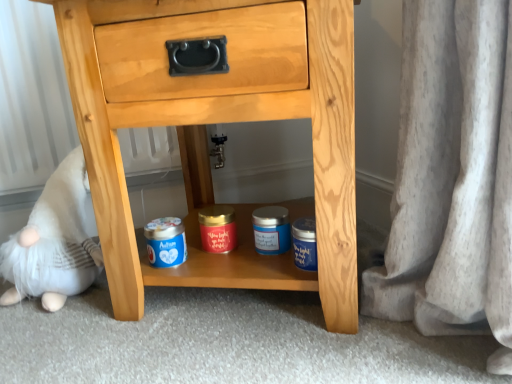
Identify the location of white plush toy at lower left. This screenshot has width=512, height=384. (53, 242).

Describe the element at coordinates (53, 242) in the screenshot. I see `white plush toy at lower left` at that location.

This screenshot has width=512, height=384. What do you see at coordinates (206, 141) in the screenshot?
I see `natural wood chest of drawers at center` at bounding box center [206, 141].

This screenshot has height=384, width=512. Identify the location of natural wood chest of drawers at center. (206, 141).

In order to face natural wood chest of drawers at center, should I rotate leftwards or rightwards?

You should rotate left by 1.615 degrees.

Measure the distance between natural wood chest of drawers at center and camera.

natural wood chest of drawers at center and camera are 22.48 inches apart from each other.

Find the location of `white plush toy at lower left`. white plush toy at lower left is located at coordinates [x=53, y=242].

Visually, is natural wood chest of drawers at center positioned to the left or to the right of white plush toy at lower left?

natural wood chest of drawers at center is to the right of white plush toy at lower left.

Is the position of natural wood chest of drawers at center more distant than that of white plush toy at lower left?

No, natural wood chest of drawers at center is closer to the camera.

Which is nearer, (143, 271) or (77, 181)?

Point (143, 271).

From the image's perspective, is natural wood chest of drawers at center over white plush toy at lower left?

Indeed, from the image's perspective, natural wood chest of drawers at center is shown above white plush toy at lower left.

From the picture: From a real-world perspective, is natural wood chest of drawers at center under white plush toy at lower left?

Actually, natural wood chest of drawers at center is physically above white plush toy at lower left in the real world.

Can you confirm if natural wood chest of drawers at center is wider than white plush toy at lower left?

Indeed, natural wood chest of drawers at center has a greater width compared to white plush toy at lower left.

Considering the relative sizes of natural wood chest of drawers at center and white plush toy at lower left in the image provided, is natural wood chest of drawers at center shorter than white plush toy at lower left?

No, natural wood chest of drawers at center is not shorter than white plush toy at lower left.

Can you confirm if natural wood chest of drawers at center is bigger than white plush toy at lower left?

Correct, natural wood chest of drawers at center is larger in size than white plush toy at lower left.

Could white plush toy at lower left be considered to be inside natural wood chest of drawers at center?

No, natural wood chest of drawers at center does not contain white plush toy at lower left.

Are natural wood chest of drawers at center and white plush toy at lower left beside each other?

No.

Is natural wood chest of drawers at center positioned with its back to white plush toy at lower left?

natural wood chest of drawers at center does not have its back to white plush toy at lower left.

At what (x,y) coordinates should I click in order to perform the action: click on toy directly beneath the natural wood chest of drawers at center (from a real-world perspective). Please return your answer as a coordinate pair (x, y). The image size is (512, 384). Looking at the image, I should click on (53, 242).

Considering the relative positions of white plush toy at lower left and natural wood chest of drawers at center in the image provided, is white plush toy at lower left to the left of natural wood chest of drawers at center from the viewer's perspective?

Indeed, white plush toy at lower left is positioned on the left side of natural wood chest of drawers at center.

Is white plush toy at lower left closer to camera compared to natural wood chest of drawers at center?

No, white plush toy at lower left is behind natural wood chest of drawers at center.

Which is farther from the camera, (x=82, y=171) or (x=138, y=59)?

The point (x=82, y=171) is behind.

From the image's perspective, between white plush toy at lower left and natural wood chest of drawers at center, which one is located above?

From the image's view, natural wood chest of drawers at center is above.

From a real-world perspective, who is located higher, white plush toy at lower left or natural wood chest of drawers at center?

From a 3D spatial view, natural wood chest of drawers at center is above.

Considering the sizes of objects white plush toy at lower left and natural wood chest of drawers at center in the image provided, who is thinner, white plush toy at lower left or natural wood chest of drawers at center?

white plush toy at lower left is thinner.

Consider the image. Can you confirm if white plush toy at lower left is taller than natural wood chest of drawers at center?

No.

Does white plush toy at lower left have a smaller size compared to natural wood chest of drawers at center?

Correct, white plush toy at lower left occupies less space than natural wood chest of drawers at center.

Is natural wood chest of drawers at center located within white plush toy at lower left?

No.

Is white plush toy at lower left with natural wood chest of drawers at center?

There is a gap between white plush toy at lower left and natural wood chest of drawers at center.

Is white plush toy at lower left oriented towards natural wood chest of drawers at center?

No.

Measure the distance from white plush toy at lower left to natural wood chest of drawers at center.

white plush toy at lower left is 11.97 inches away from natural wood chest of drawers at center.

Where is `the chest of drawers located in front of the white plush toy at lower left`? This screenshot has width=512, height=384. the chest of drawers located in front of the white plush toy at lower left is located at coordinates (x=206, y=141).

Locate an element on the screen. Image resolution: width=512 pixels, height=384 pixels. the chest of drawers in front of the white plush toy at lower left is located at coordinates (206, 141).

This screenshot has height=384, width=512. What are the coordinates of `chest of drawers on the right of the white plush toy at lower left` in the screenshot? It's located at (206, 141).